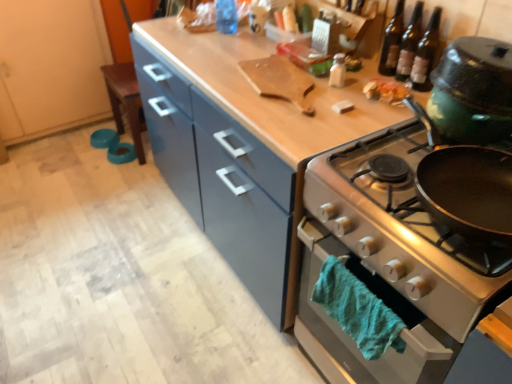
The width and height of the screenshot is (512, 384). In order to click on vacant space in front of transparent plastic bottle at upper center, acting as the first bottle starting from the left in this screenshot , I will do `click(230, 49)`.